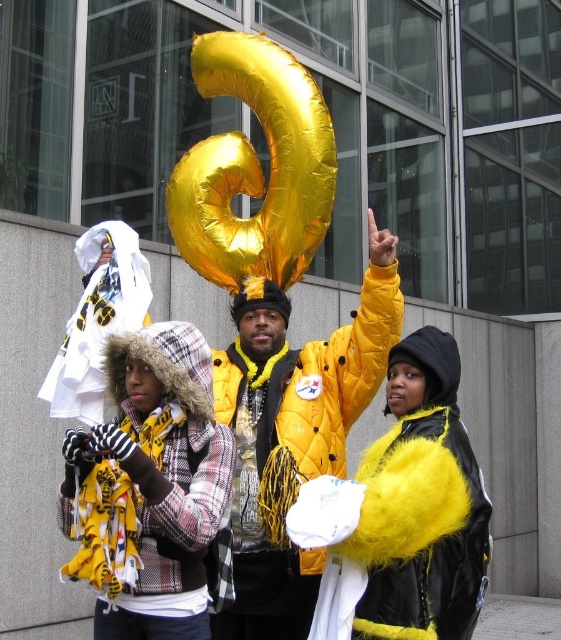
You are standing in front of the modern building with large glass windows. You see a point at coordinates (403, 513). What object is located at that point?

The fuzzy yellow jacket at center is located at point (403, 513).